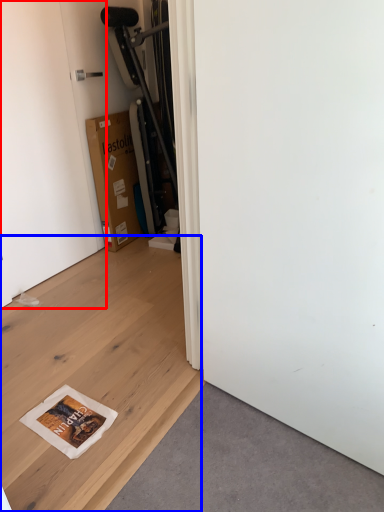
Question: Which object is closer to the camera taking this photo, door (highlighted by a red box) or plywood (highlighted by a blue box)?

Choices:
 (A) door
 (B) plywood

Answer: (B)